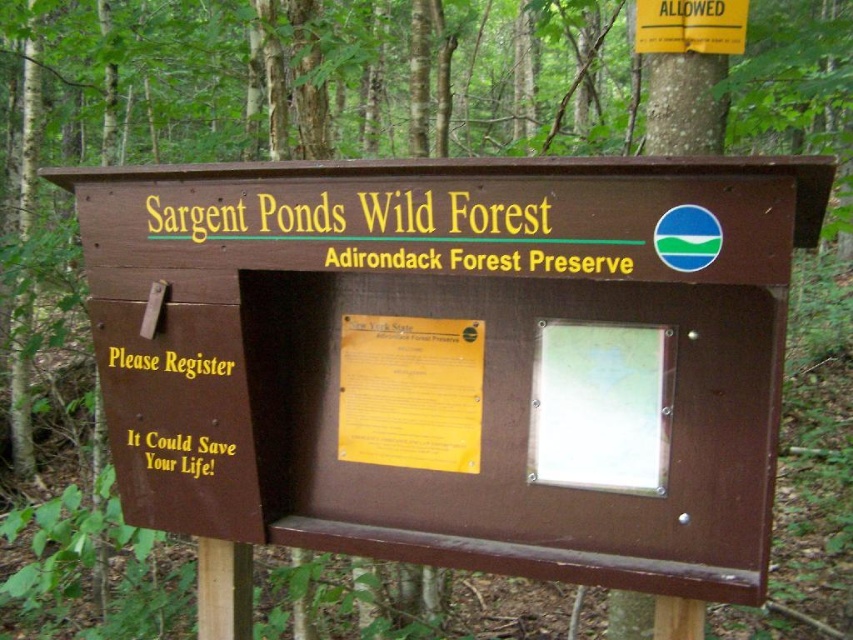
Question: Which point is closer to the camera taking this photo?

Choices:
 (A) (184, 456)
 (B) (428, 220)

Answer: (B)

Question: Which point is farther to the camera?

Choices:
 (A) (473, 209)
 (B) (230, 369)

Answer: (B)

Question: Which point is closer to the camera?

Choices:
 (A) (129, 356)
 (B) (608, 438)

Answer: (B)

Question: Does yellow paper at center appear on the left side of yellowmaterial/texturetext at center?

Choices:
 (A) no
 (B) yes

Answer: (A)

Question: Where is brown wood sign at center located in relation to yellowmaterial/texturetext at center in the image?

Choices:
 (A) left
 (B) right

Answer: (B)

Question: Is yellowwooden sign at center positioned before yellow metallic text at lower left?

Choices:
 (A) no
 (B) yes

Answer: (B)